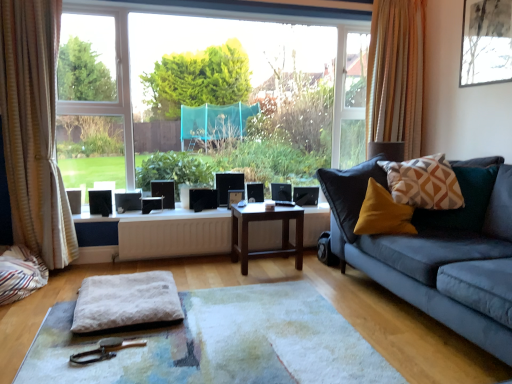
This screenshot has width=512, height=384. In order to click on blank space situated above white matte radiator at center (from a real-world perspective) in this screenshot , I will do tap(161, 220).